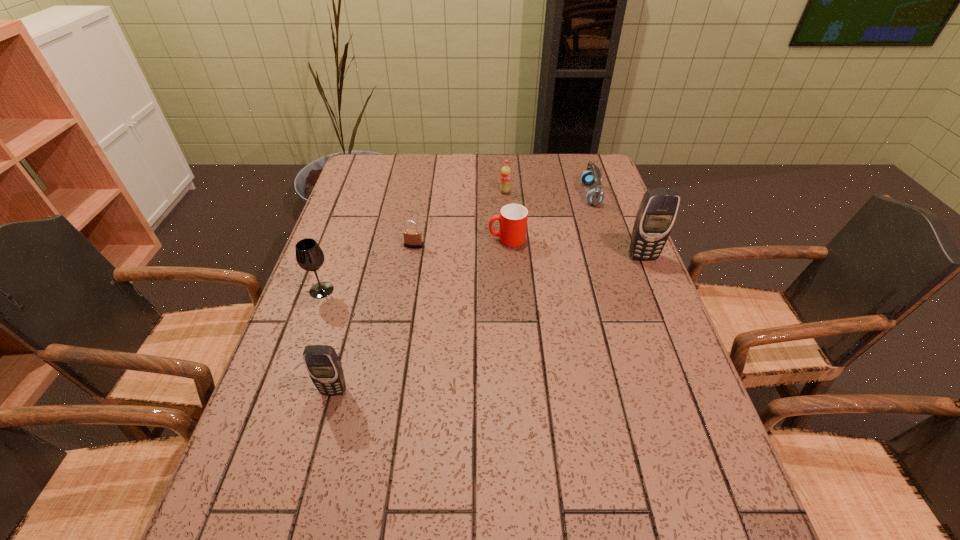
Image resolution: width=960 pixels, height=540 pixels. What are the coordinates of `spot to insert another cellular_telephone for uniform distribution` in the screenshot? It's located at (510, 314).